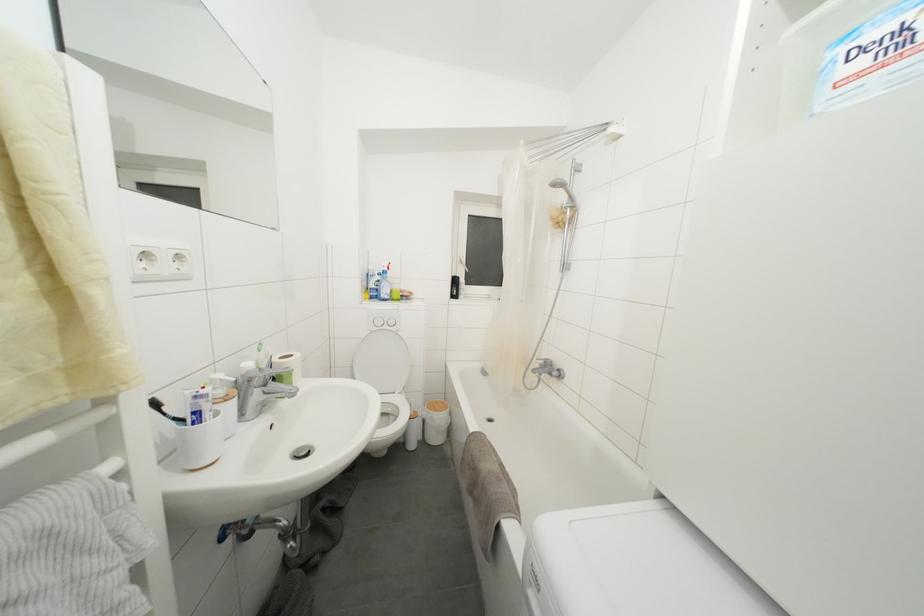
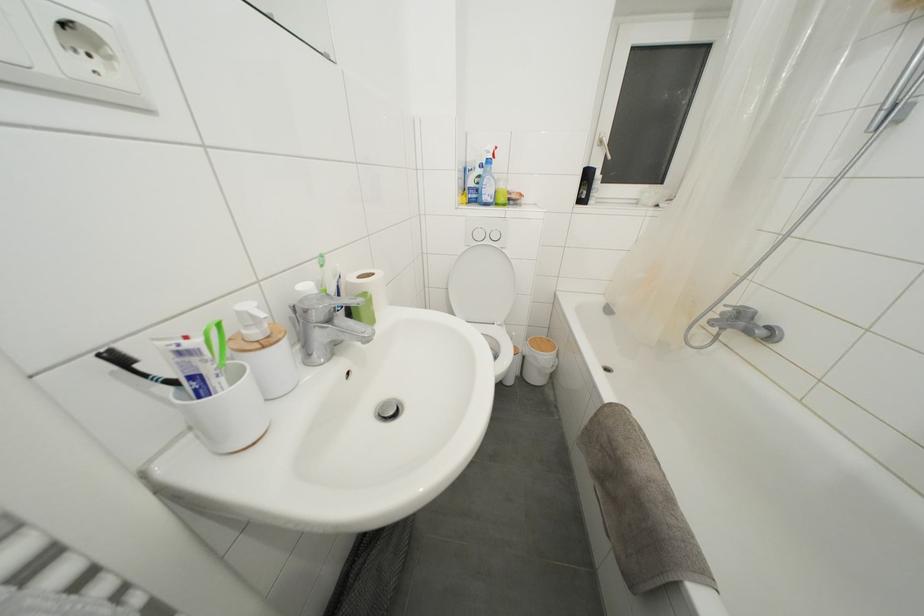
Locate, in the second image, the point that corresponds to point 224,381 in the first image.

(253, 310)